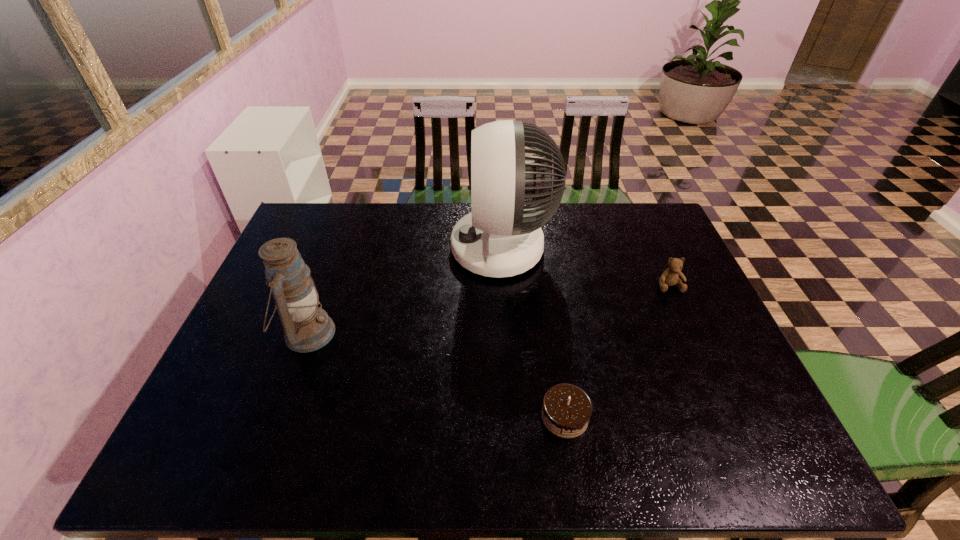
Where is `free space located 0.120m on the back of the chocolate cake`? free space located 0.120m on the back of the chocolate cake is located at coordinates (555, 354).

Find the location of `object that is at the far edge`. object that is at the far edge is located at coordinates (501, 237).

Image resolution: width=960 pixels, height=540 pixels. What are the coordinates of `object positioned at the near edge` in the screenshot? It's located at (566, 411).

Where is `object present at the left edge`? The width and height of the screenshot is (960, 540). object present at the left edge is located at coordinates (307, 327).

You are a GUI agent. You are given a task and a screenshot of the screen. Output one action in this format:
    pyautogui.click(x=<x>, y=<y>)
    Task: Click on the object that is at the right edge
    This screenshot has width=960, height=540.
    Given the screenshot: What is the action you would take?
    coord(670,277)

At what (x,y) coordinates should I click in order to perform the action: click on vacant space at the far edge of the desktop. Please return your answer as a coordinate pair (x, y). This screenshot has width=960, height=540. Looking at the image, I should click on (417, 214).

In order to click on vacant area at the left edge in this screenshot , I will do point(269,400).

I want to click on free location at the right edge, so point(698,296).

In the image, there is a desktop. At what (x,y) coordinates should I click in order to perform the action: click on vacant space at the far left corner. Please return your answer as a coordinate pair (x, y). Looking at the image, I should click on (x=346, y=204).

This screenshot has width=960, height=540. I want to click on vacant space at the near left corner of the desktop, so click(x=212, y=451).